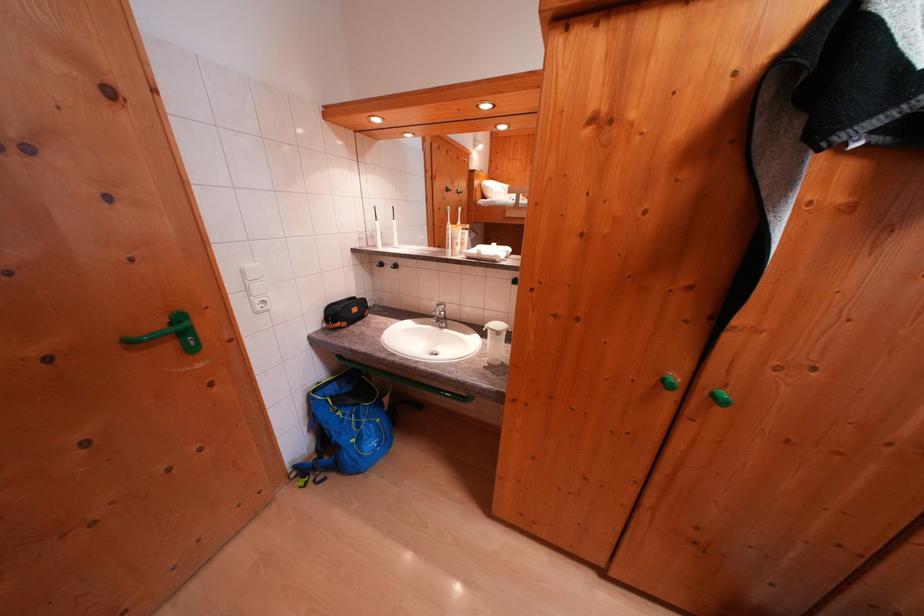
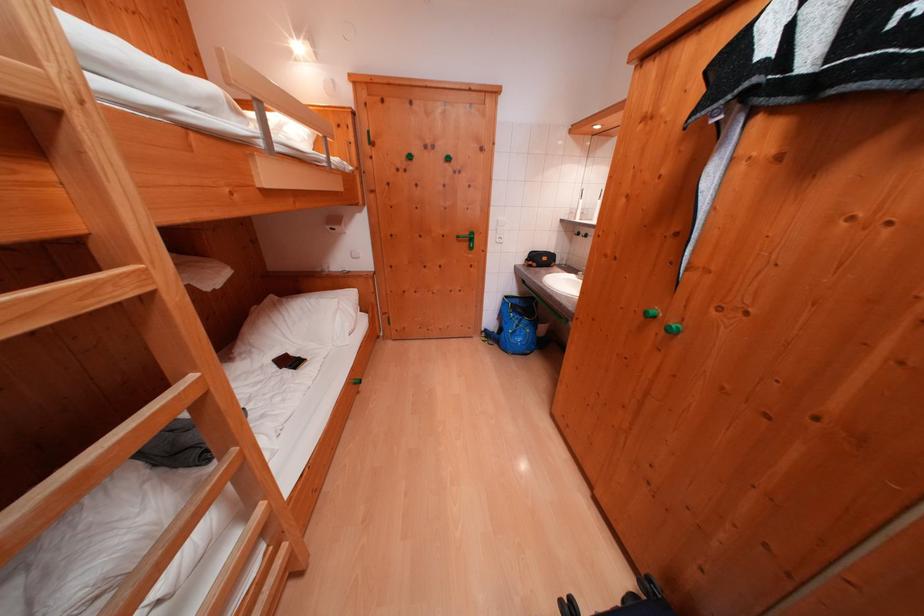
In the second image, find the point that corresponds to the point at 140,347 in the first image.

(466, 241)